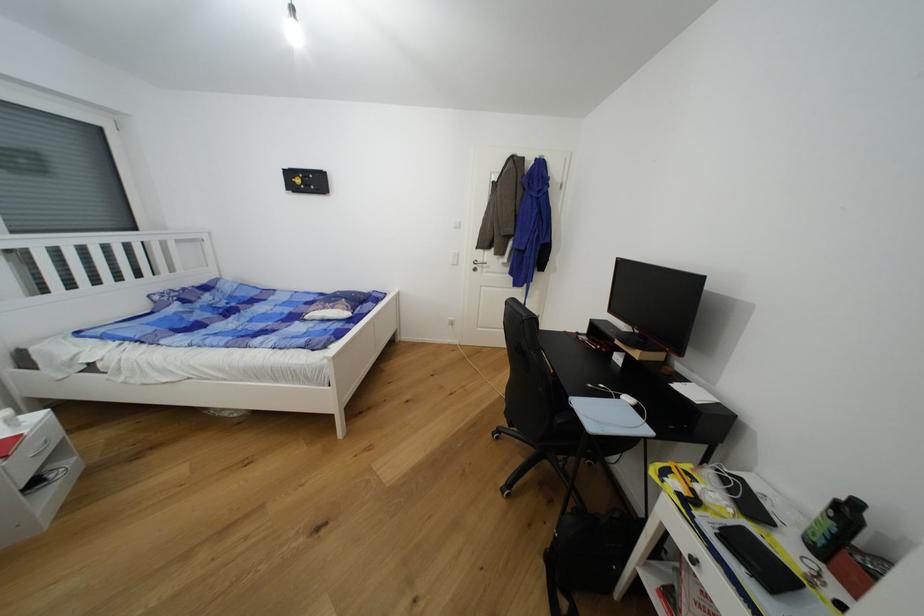
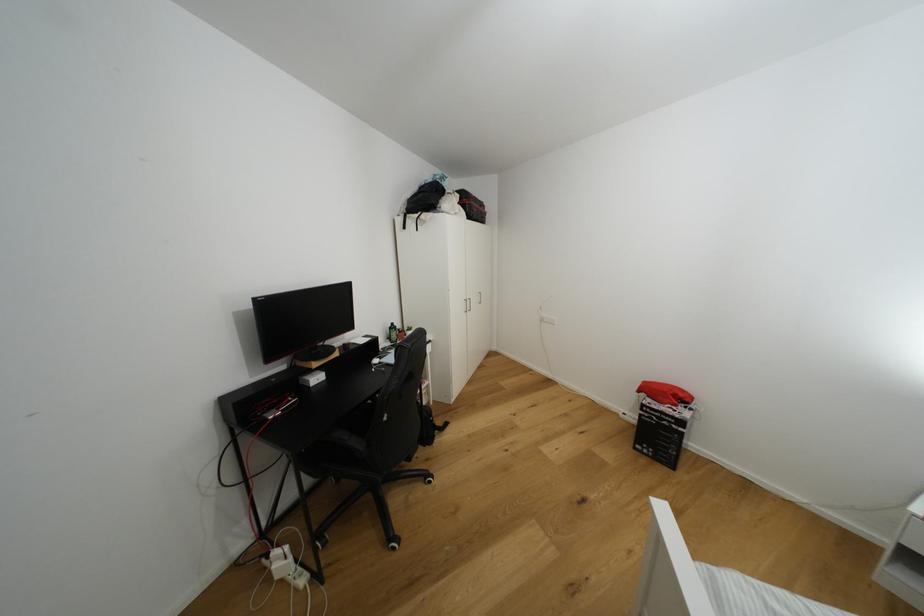
Question: I am providing you with two images of the same scene from different viewpoints. Which of the following objects are not visible in image2?

Choices:
 (A) white cabinet handle
 (B) small white box
 (C) green bottle
 (D) none of these

Answer: (D)